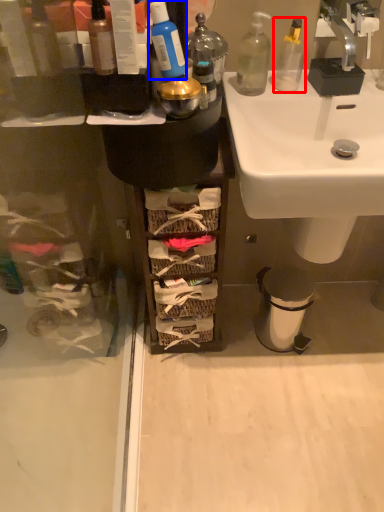
Question: Among these objects, which one is nearest to the camera, bottle (highlighted by a red box) or toiletry (highlighted by a blue box)?

Choices:
 (A) bottle
 (B) toiletry

Answer: (B)